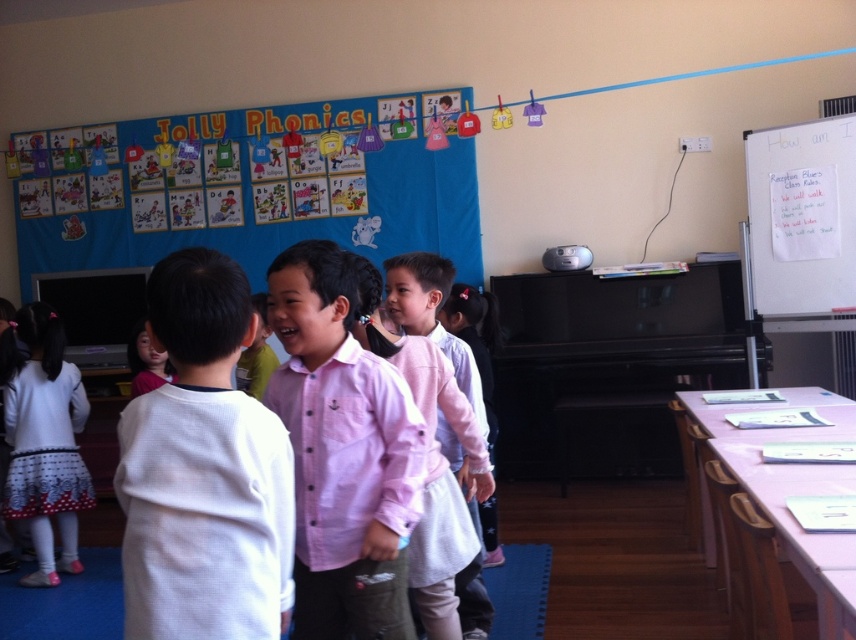
You are a teacher in the classroom. You notice the white paper at upper right and the pink cotton shirt at center. Which object is shorter in height?

The white paper at upper right is not as tall as the pink cotton shirt at center, so the white paper at upper right is shorter in height.

You are a teacher in the classroom and want to locate the white dotted dress at lower left. Where should you look in the classroom?

The white dotted dress at lower left is located at the 2D coordinates point (43, 440) in the classroom.

You are a teacher in the classroom. You need to hand out a worksheet to a student wearing a pink cotton shirt at center. The white paper at upper right is the worksheet. Can you reach it while standing near the student?

The white paper at upper right is above the pink cotton shirt at center, so you can reach it while standing near the student as it is positioned above their head.